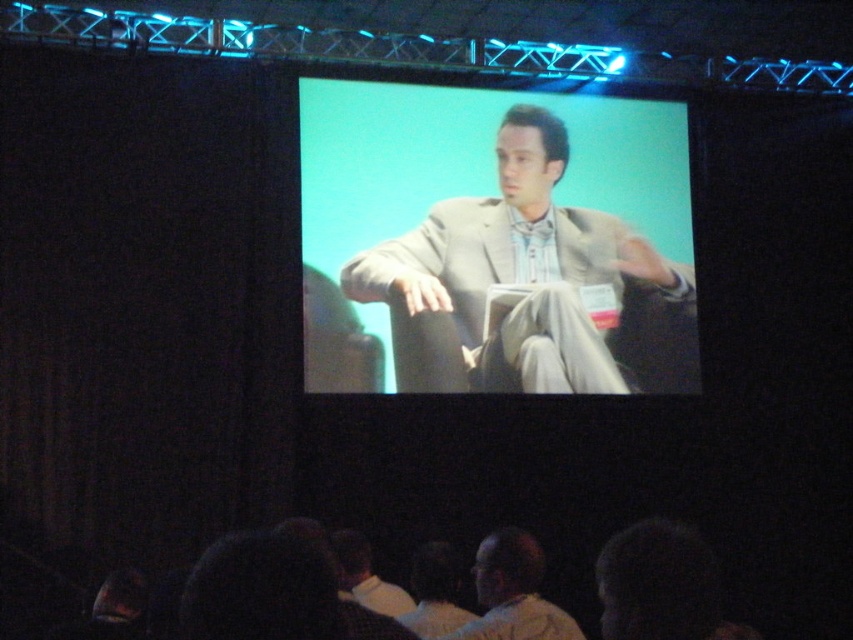
Does light beige suit at center come in front of light beige suit at lower center?

No, it is not.

Consider the image. Can you confirm if light beige suit at center is shorter than light beige suit at lower center?

No.

Who is more distant from viewer, (582, 292) or (523, 611)?

The point (582, 292) is behind.

Where is `light beige suit at center`? light beige suit at center is located at coordinates (529, 285).